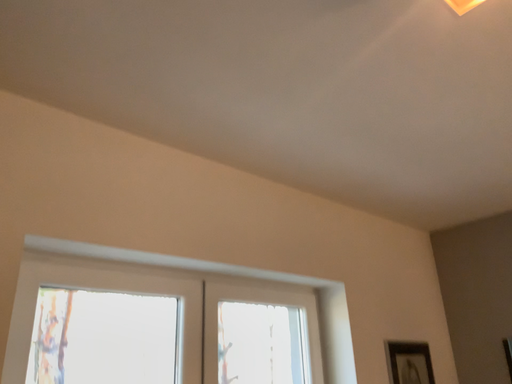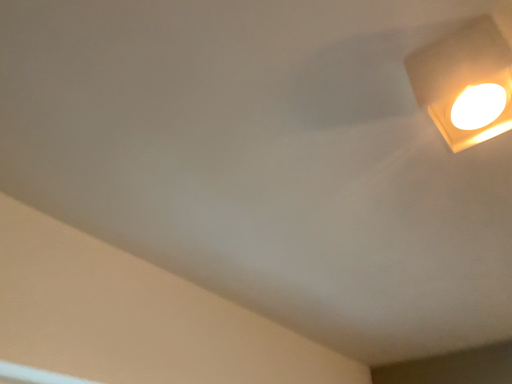
Question: Which way did the camera rotate in the video?

Choices:
 (A) rotated right
 (B) rotated left

Answer: (A)